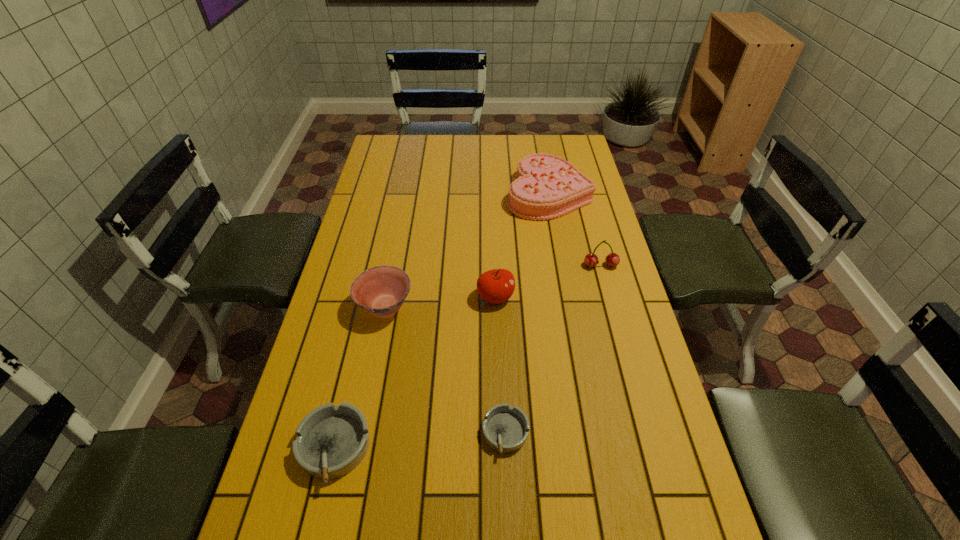
This screenshot has height=540, width=960. I want to click on the left ashtray, so click(331, 441).

Locate an element on the screen. The width and height of the screenshot is (960, 540). the taller ashtray is located at coordinates pyautogui.click(x=331, y=441).

I want to click on the shortest object, so click(505, 428).

I want to click on the shorter ashtray, so click(x=505, y=428).

I want to click on cake, so click(x=547, y=186).

This screenshot has width=960, height=540. I want to click on the fifth nearest object, so click(591, 260).

Identify the location of bowl. The image size is (960, 540). (381, 290).

The image size is (960, 540). I want to click on apple, so click(x=495, y=286).

You are a GUI agent. You are given a task and a screenshot of the screen. Output one action in this format:
    pyautogui.click(x=<x>, y=<y>)
    Task: Click on the free space located 0.160m on the back of the left ashtray
    The height and width of the screenshot is (540, 960).
    Given the screenshot: What is the action you would take?
    pyautogui.click(x=355, y=356)

At what (x,y) coordinates should I click in order to perform the action: click on vacant space located 0.390m on the back of the shorter ashtray. Please return your answer as a coordinate pair (x, y). Looking at the image, I should click on (499, 291).